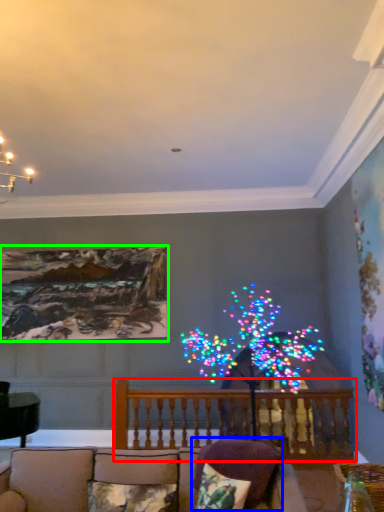
Question: Considering the real-world distances, which object is closest to balcony (highlighted by a red box)? pillow (highlighted by a blue box) or picture frame (highlighted by a green box).

Choices:
 (A) pillow
 (B) picture frame

Answer: (A)